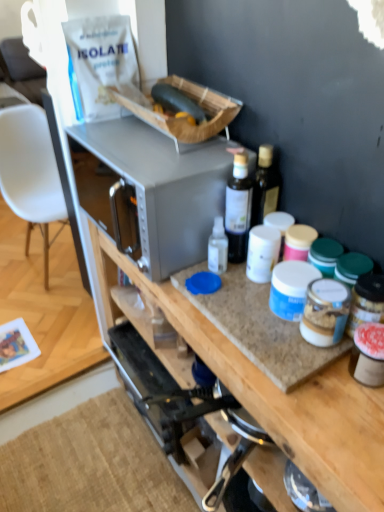
At what (x,y) coordinates should I click in order to perform the action: click on blank space to the left of green matte zucchini at upper center. Please return your answer as a coordinate pair (x, y). Image resolution: width=384 pixels, height=512 pixels. Looking at the image, I should click on (117, 134).